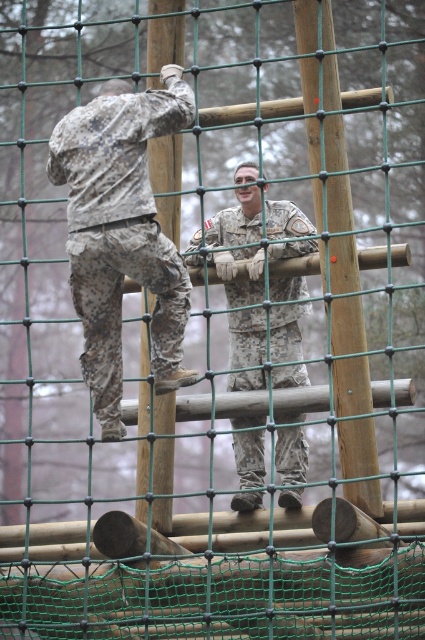
Question: Which point is closer to the camera?

Choices:
 (A) (308, 52)
 (B) (175, 188)
 (C) (297, 378)
 (D) (110, 141)

Answer: (D)

Question: Can you confirm if camouflage fabric soldier at center is thinner than wooden pole at center?

Choices:
 (A) no
 (B) yes

Answer: (A)

Question: Is camouflage fabric soldier at center bigger than wooden pole at center?

Choices:
 (A) no
 (B) yes

Answer: (B)

Question: Which point is closer to the camera?

Choices:
 (A) (172, 337)
 (B) (312, 45)
 (C) (260, 232)

Answer: (A)

Question: Which point is farther from the camera taking this photo?

Choices:
 (A) (320, 198)
 (B) (294, 451)
 (C) (149, 154)
 (D) (172, 264)

Answer: (B)

Question: Is camouflage fabric soldier at upper left thinner than camouflage fabric soldier at center?

Choices:
 (A) no
 (B) yes

Answer: (A)